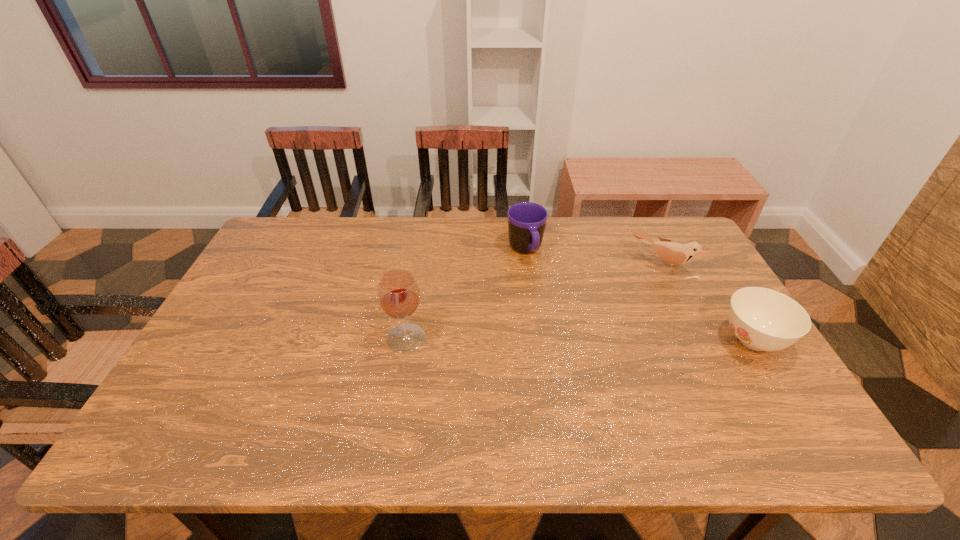
The height and width of the screenshot is (540, 960). Find the location of `free area in between the tallest object and the second object from left to right`. free area in between the tallest object and the second object from left to right is located at coordinates (466, 294).

Identify the location of empty location between the sugar bowl and the mug. This screenshot has width=960, height=540. (639, 296).

Locate an element on the screen. vacant space that is in between the tallest object and the mug is located at coordinates (466, 294).

Image resolution: width=960 pixels, height=540 pixels. Find the location of `vacant area between the bird and the sugar bowl`. vacant area between the bird and the sugar bowl is located at coordinates (707, 303).

Locate an element on the screen. Image resolution: width=960 pixels, height=540 pixels. the third closest object to the bird is located at coordinates (398, 293).

At what (x,y) coordinates should I click in order to perform the action: click on object that stands as the closest to the bird. Please return your answer as a coordinate pair (x, y). The image size is (960, 540). Looking at the image, I should click on (762, 319).

Where is `free space that satisfies the following two spatial constraints: 1. on the back side of the tallest object; 2. on the left side of the bird`? free space that satisfies the following two spatial constraints: 1. on the back side of the tallest object; 2. on the left side of the bird is located at coordinates (418, 266).